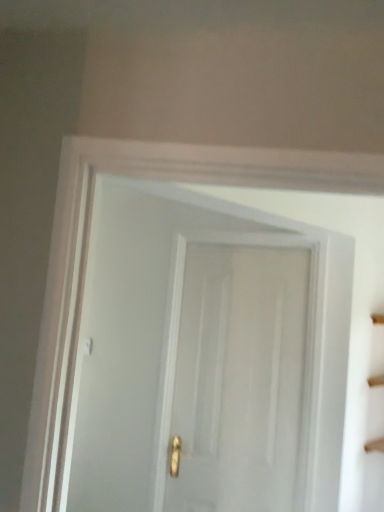
What do you see at coordinates (375, 445) in the screenshot?
I see `white matte stair at right` at bounding box center [375, 445].

Where is `white matte stair at right`? This screenshot has height=512, width=384. white matte stair at right is located at coordinates (375, 445).

Where is `white matte stair at right`? This screenshot has width=384, height=512. white matte stair at right is located at coordinates (375, 445).